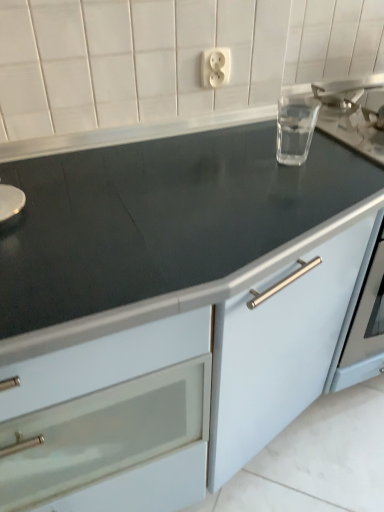
Question: Considering the positions of white plastic outlet at upper center and transparent glass at upper right in the image, is white plastic outlet at upper center bigger or smaller than transparent glass at upper right?

Choices:
 (A) big
 (B) small

Answer: (B)

Question: Would you say white plastic outlet at upper center is to the left or to the right of transparent glass at upper right in the picture?

Choices:
 (A) left
 (B) right

Answer: (A)

Question: Considering the real-world distances, which object is farthest from the white plastic outlet at upper center?

Choices:
 (A) matte white cabinet at center
 (B) transparent glass at upper right

Answer: (A)

Question: Which object is positioned farthest from the matte white cabinet at center?

Choices:
 (A) transparent glass at upper right
 (B) white plastic outlet at upper center

Answer: (B)